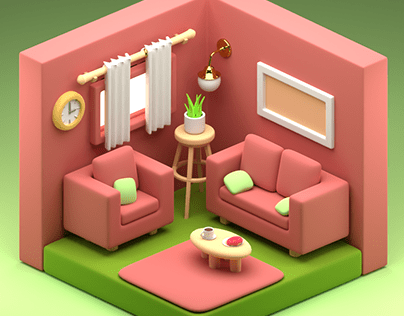
This screenshot has width=404, height=316. I want to click on couch, so click(x=289, y=176).